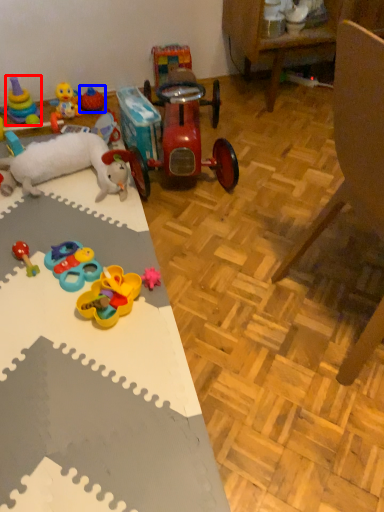
Question: Which object appears farthest to the camera in this image, toy (highlighted by a red box) or toy (highlighted by a blue box)?

Choices:
 (A) toy
 (B) toy

Answer: (B)